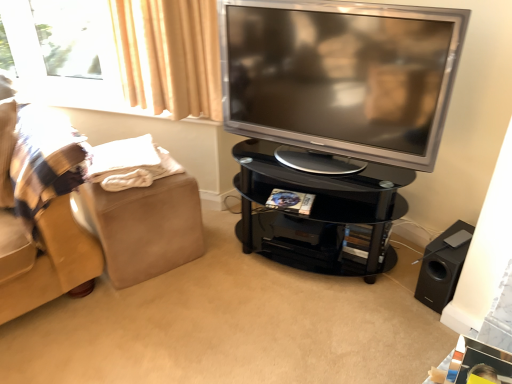
Find the location of `vacant area that is in front of black glass tv stand at center`. vacant area that is in front of black glass tv stand at center is located at coordinates (310, 324).